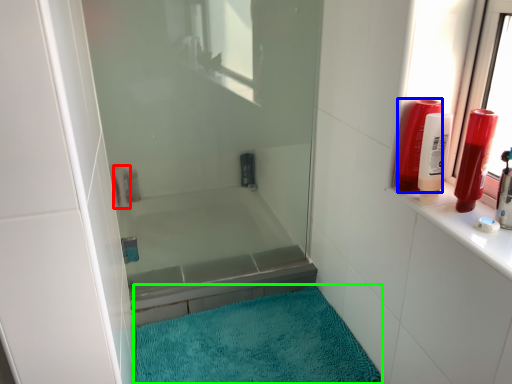
Question: Estimate the real-world distances between objects in this image. Which object is farther from toiletry (highlighted by a red box), toiletry (highlighted by a blue box) or bath mat (highlighted by a green box)?

Choices:
 (A) toiletry
 (B) bath mat

Answer: (A)